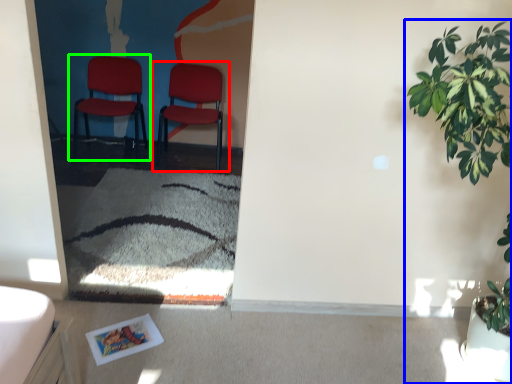
Question: Which object is the closest to the chair (highlighted by a red box)? Choose among these: houseplant (highlighted by a blue box) or chair (highlighted by a green box).

Choices:
 (A) houseplant
 (B) chair

Answer: (B)